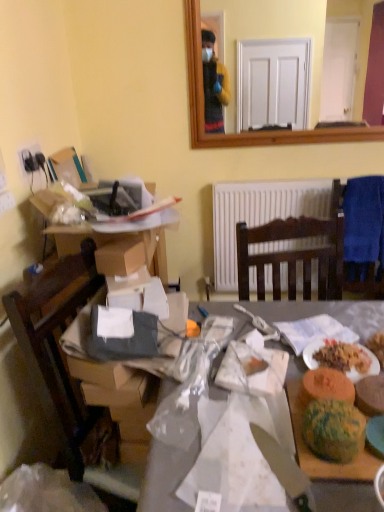
Find the location of a particular element. The image size is (384, 512). free space above white paper at center (from a real-world perspective) is located at coordinates (246, 431).